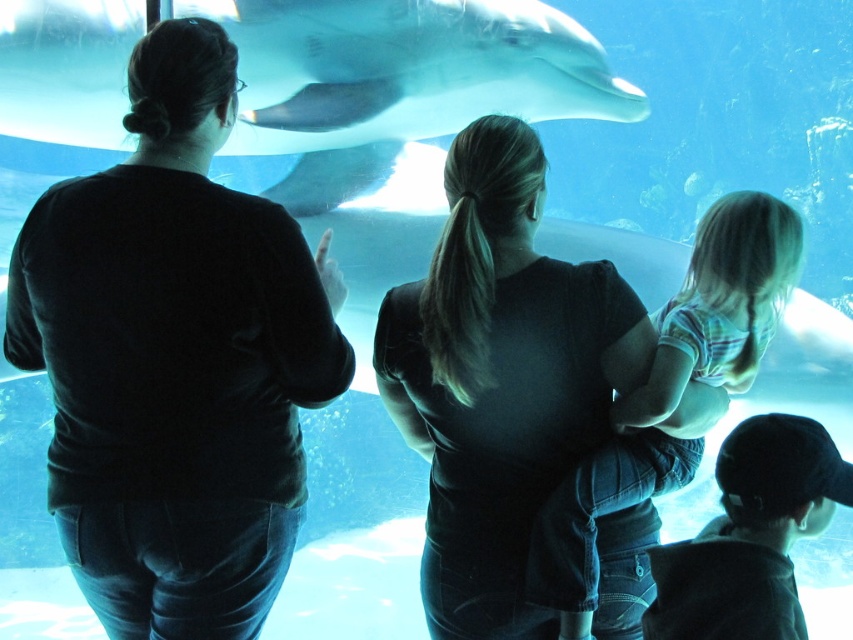
Question: Which point is closer to the camera taking this photo?

Choices:
 (A) (219, 275)
 (B) (587, 538)
 (C) (390, 116)

Answer: (A)

Question: Estimate the real-world distances between objects in this image. Which object is closer to the matte black shirt at upper left?

Choices:
 (A) white smooth dolphin at upper center
 (B) striped cotton shirt at center

Answer: (B)

Question: Can you confirm if black matte shirt at center is positioned above white smooth dolphin at upper center?

Choices:
 (A) yes
 (B) no

Answer: (B)

Question: Which object is farther from the camera taking this photo?

Choices:
 (A) striped cotton shirt at center
 (B) black matte shirt at center
 (C) white smooth dolphin at upper center
 (D) matte black shirt at upper left

Answer: (C)

Question: Does black matte shirt at center have a smaller size compared to white smooth dolphin at upper center?

Choices:
 (A) no
 (B) yes

Answer: (B)

Question: Is matte black shirt at upper left behind white smooth dolphin at upper center?

Choices:
 (A) no
 (B) yes

Answer: (A)